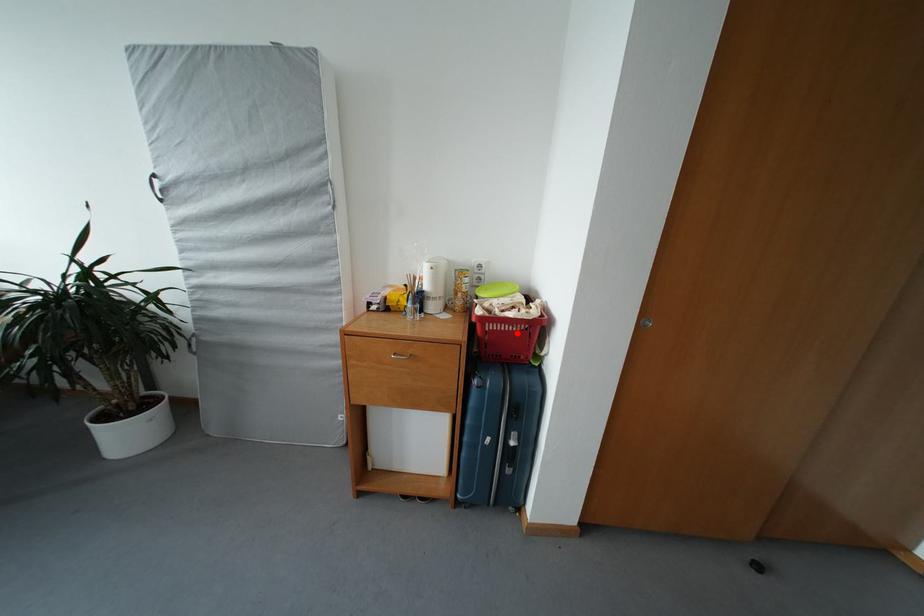
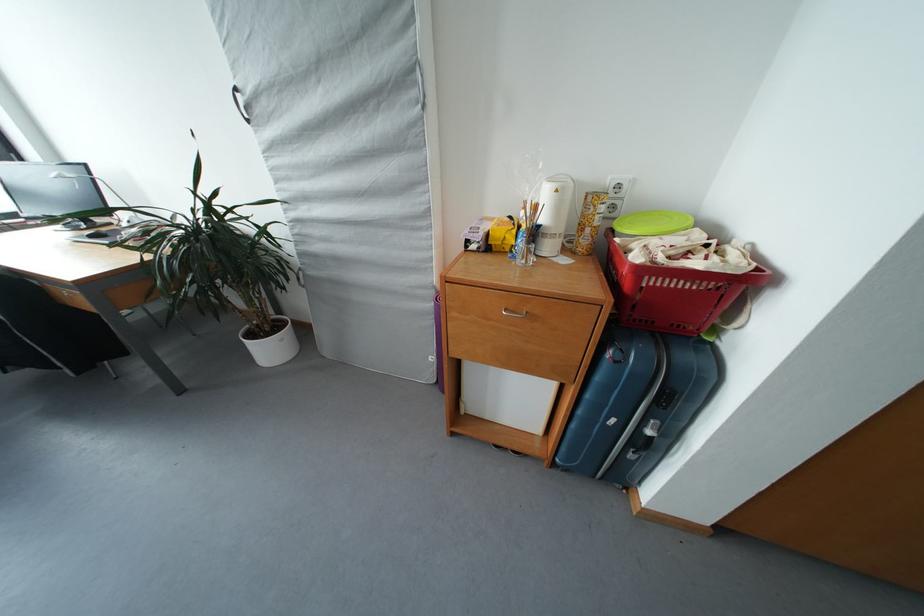
In the second image, find the point that corresponds to the highlighted location in the first image.

(694, 291)